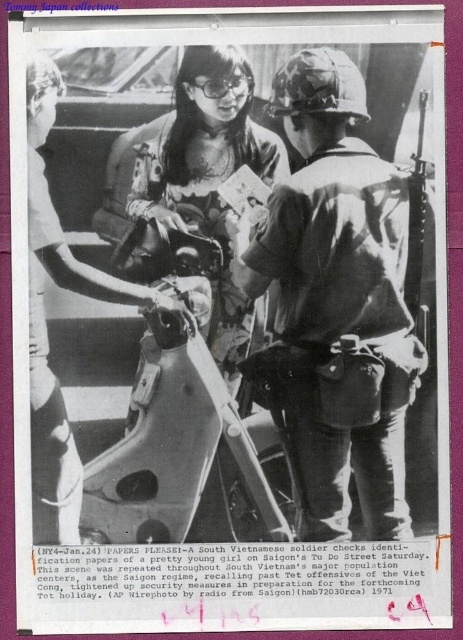
You are a photographer trying to capture a closeup shot of both the camouflage fabric helmet at center and the matte black goggles at upper center in the scene. Given that your camera can only focus on objects within a 30 cm range, will you be able to capture both items in focus without adjusting your camera settings?

The camouflage fabric helmet at center and matte black goggles at upper center are 36.24 centimeters apart from each other. Since the distance between them exceeds the camera focus range of 30 cm, you will need to adjust your camera settings to ensure both items are in focus.